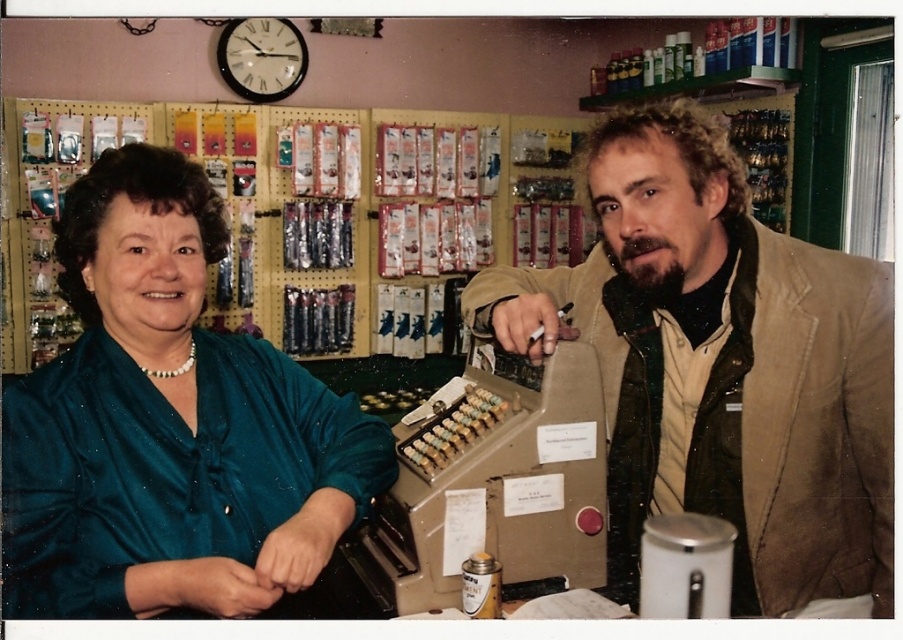
Question: Does brown leather jacket at right appear over green satin blouse at left?

Choices:
 (A) yes
 (B) no

Answer: (B)

Question: Does brown leather jacket at right have a lesser width compared to green satin blouse at left?

Choices:
 (A) yes
 (B) no

Answer: (B)

Question: Which of the following is the farthest from the observer?

Choices:
 (A) (699, 202)
 (B) (61, 388)

Answer: (A)

Question: Which object appears closest to the camera in this image?

Choices:
 (A) green satin blouse at left
 (B) brown leather jacket at right

Answer: (A)

Question: Does brown leather jacket at right have a lesser width compared to green satin blouse at left?

Choices:
 (A) yes
 (B) no

Answer: (B)